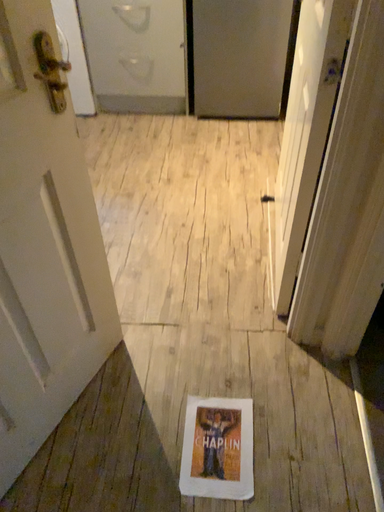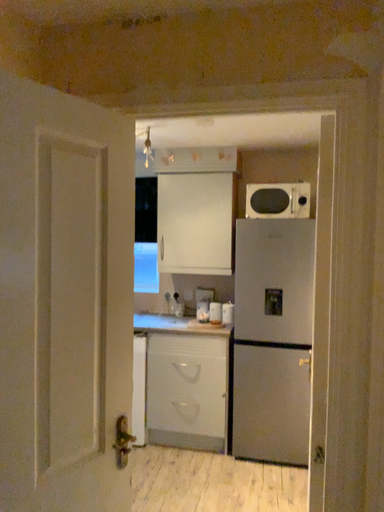
Question: How did the camera likely rotate when shooting the video?

Choices:
 (A) rotated downward
 (B) rotated upward

Answer: (B)